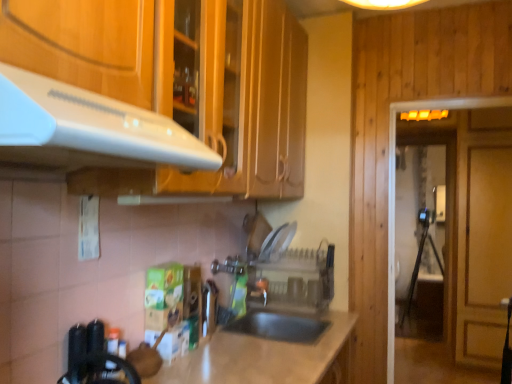
Question: Relative to transparent glass door at right, the first glass door in the back-to-front sequence, is transparent glass door at right, the first glass door from the front, in front or behind?

Choices:
 (A) front
 (B) behind

Answer: (A)

Question: Considering the positions of transparent glass door at right, the second glass door in the back-to-front sequence, and transparent glass door at right, which ranks as the 1th glass door in right-to-left order, in the image, is transparent glass door at right, the second glass door in the back-to-front sequence, wider or thinner than transparent glass door at right, which ranks as the 1th glass door in right-to-left order,?

Choices:
 (A) thin
 (B) wide

Answer: (A)

Question: Which object is the closest to the transparent glass door at right, the first glass door in the back-to-front sequence?

Choices:
 (A) metallic silver faucet at center
 (B) transparent glass door at right, the first glass door from the front
 (C) clear plastic dish rack at center
 (D) white glossy exhaust hood at upper left

Answer: (B)

Question: Which object is positioned farthest from the metallic silver faucet at center?

Choices:
 (A) transparent glass door at right, the first glass door from the front
 (B) white glossy exhaust hood at upper left
 (C) transparent glass door at right, which ranks as the 1th glass door in right-to-left order
 (D) clear plastic dish rack at center

Answer: (C)